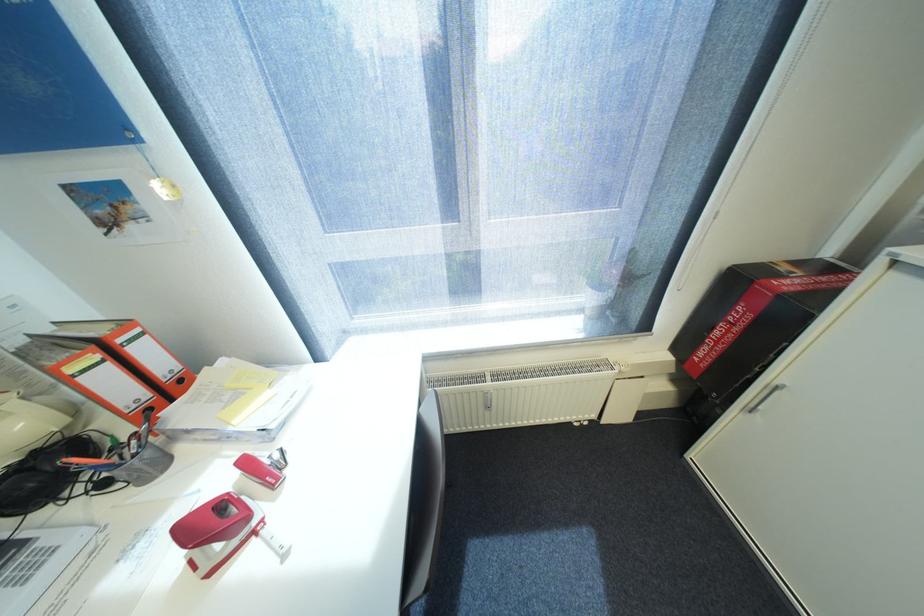
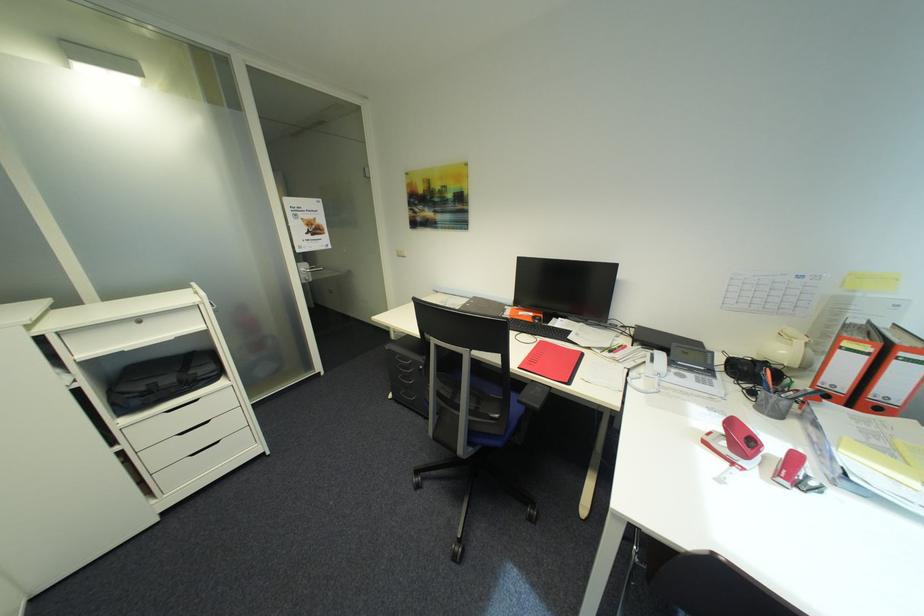
Where in the second image is the point corresponding to (x=261, y=533) from the first image?

(742, 464)